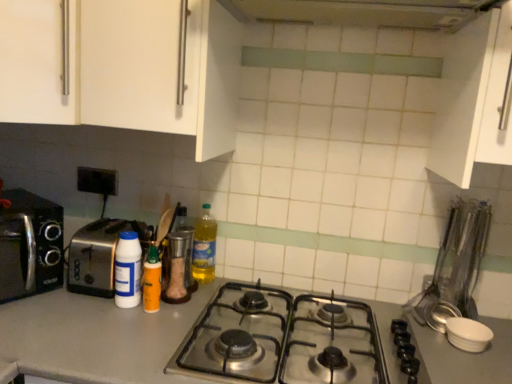
Question: Is orange matte squeeze bottle at center, the second bottle viewed from the left, shorter than translucent plastic bottle at center, which ranks as the first bottle in right-to-left order?

Choices:
 (A) yes
 (B) no

Answer: (A)

Question: From the image's perspective, is orange matte squeeze bottle at center, placed as the third bottle when sorted from right to left, over translucent plastic bottle at center, acting as the 4th bottle starting from the left?

Choices:
 (A) no
 (B) yes

Answer: (A)

Question: From the image's perspective, would you say orange matte squeeze bottle at center, placed as the third bottle when sorted from right to left, is shown under translucent plastic bottle at center, acting as the 4th bottle starting from the left?

Choices:
 (A) yes
 (B) no

Answer: (A)

Question: Is orange matte squeeze bottle at center, placed as the third bottle when sorted from right to left, smaller than translucent plastic bottle at center, acting as the 4th bottle starting from the left?

Choices:
 (A) no
 (B) yes

Answer: (B)

Question: From a real-world perspective, is orange matte squeeze bottle at center, placed as the third bottle when sorted from right to left, positioned over translucent plastic bottle at center, acting as the 4th bottle starting from the left, based on gravity?

Choices:
 (A) yes
 (B) no

Answer: (B)

Question: From a real-world perspective, is translucent plastic bottle at center, which ranks as the first bottle in right-to-left order, above or below white matte cabinet at upper right, which ranks as the second cabinetry in left-to-right order?

Choices:
 (A) above
 (B) below

Answer: (B)

Question: Is point (195, 228) positioned closer to the camera than point (496, 153)?

Choices:
 (A) farther
 (B) closer

Answer: (A)

Question: Based on their positions, is translucent plastic bottle at center, acting as the 4th bottle starting from the left, located to the left or right of white matte cabinet at upper right, which ranks as the second cabinetry in left-to-right order?

Choices:
 (A) right
 (B) left

Answer: (B)

Question: Which is correct: translucent plastic bottle at center, acting as the 4th bottle starting from the left, is inside white matte cabinet at upper right, which is the 1th cabinetry from right to left, or outside of it?

Choices:
 (A) inside
 (B) outside

Answer: (B)

Question: Is silver metallic toaster at left, the 2th toaster positioned from the right, situated inside metallic silver canister at center, marked as the second bottle in a right-to-left arrangement, or outside?

Choices:
 (A) outside
 (B) inside

Answer: (A)

Question: Considering the positions of point (50, 279) and point (190, 264), is point (50, 279) closer or farther from the camera than point (190, 264)?

Choices:
 (A) farther
 (B) closer

Answer: (B)

Question: Considering their positions, is silver metallic toaster at left, the first toaster from the left, located in front of or behind metallic silver canister at center, positioned as the third bottle in left-to-right order?

Choices:
 (A) behind
 (B) front

Answer: (B)

Question: From the image's perspective, is silver metallic toaster at left, the 2th toaster positioned from the right, above or below metallic silver canister at center, positioned as the third bottle in left-to-right order?

Choices:
 (A) above
 (B) below

Answer: (A)

Question: Is translucent plastic bottle at center, acting as the 4th bottle starting from the left, in front of or behind metallic silver shaker at center in the image?

Choices:
 (A) front
 (B) behind

Answer: (B)

Question: Looking at the image, does translucent plastic bottle at center, which ranks as the first bottle in right-to-left order, seem bigger or smaller compared to metallic silver shaker at center?

Choices:
 (A) big
 (B) small

Answer: (A)